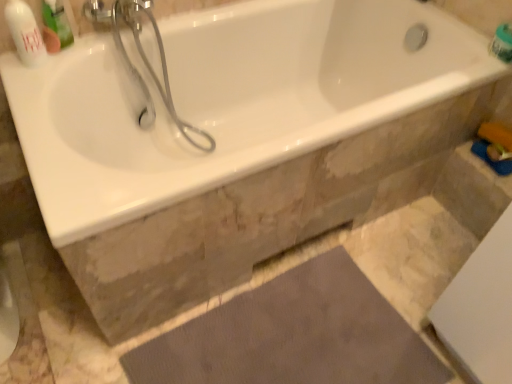
This screenshot has width=512, height=384. Identify the location of vacant space in front of green plastic mouthwash at upper left. (31, 80).